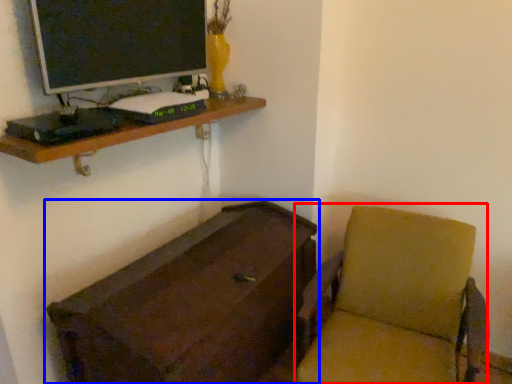
Question: Which object appears farthest to the camera in this image, swivel chair (highlighted by a red box) or furniture (highlighted by a blue box)?

Choices:
 (A) swivel chair
 (B) furniture

Answer: (B)